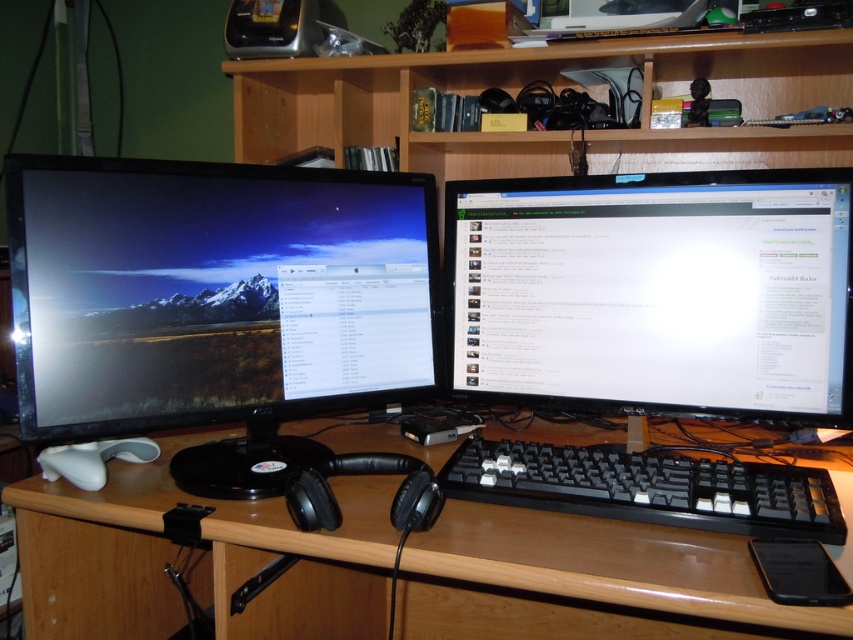
Question: From the image, what is the correct spatial relationship of matte black monitor at left in relation to black plastic keyboard at center?

Choices:
 (A) above
 (B) below

Answer: (A)

Question: Can you confirm if black matte monitor at center is positioned to the right of black plastic keyboard at center?

Choices:
 (A) no
 (B) yes

Answer: (B)

Question: Which point is closer to the camera?

Choices:
 (A) pos(648,353)
 (B) pos(74,429)

Answer: (B)

Question: Can you confirm if black matte monitor at center is positioned below wooden at center?

Choices:
 (A) yes
 (B) no

Answer: (B)

Question: Which of these objects is positioned closest to the black plastic keyboard at center?

Choices:
 (A) wooden at center
 (B) matte black monitor at left
 (C) black matte monitor at center

Answer: (C)

Question: Based on their relative distances, which object is nearer to the wooden at center?

Choices:
 (A) black matte monitor at center
 (B) black plastic keyboard at center

Answer: (B)